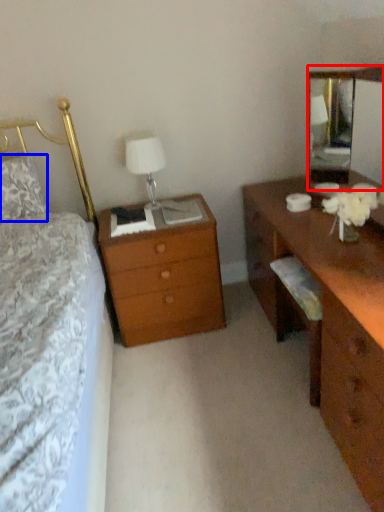
Question: Which of the following is the farthest to the observer, mirror (highlighted by a red box) or pillow (highlighted by a blue box)?

Choices:
 (A) mirror
 (B) pillow

Answer: (B)